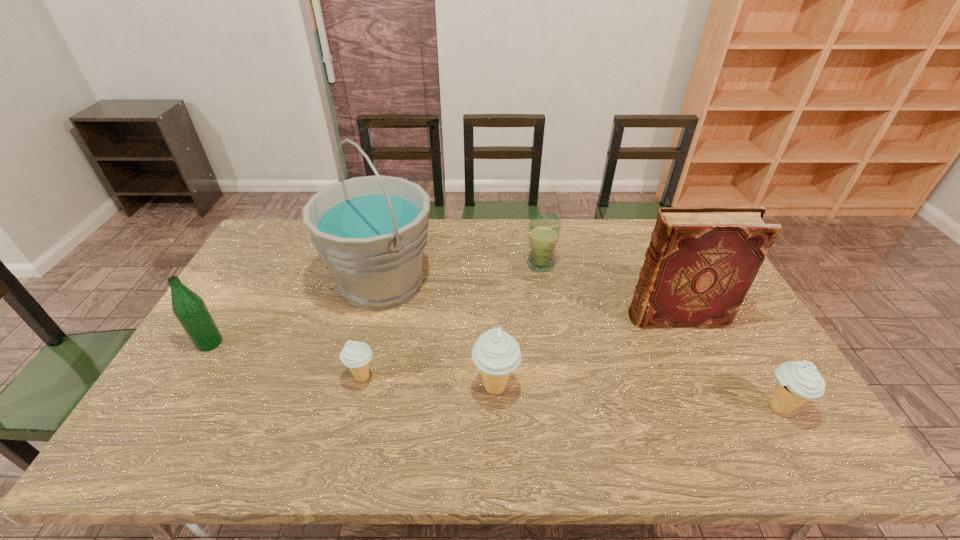
Where is `bucket present at the far edge`? The image size is (960, 540). bucket present at the far edge is located at coordinates (371, 231).

You are a GUI agent. You are given a task and a screenshot of the screen. Output one action in this format:
    pyautogui.click(x=<x>, y=<y>)
    Task: Click on the object that is at the left edge
    The width and height of the screenshot is (960, 540).
    Given the screenshot: What is the action you would take?
    pyautogui.click(x=189, y=308)

Identify the location of icecream at the right edge. The height and width of the screenshot is (540, 960). (798, 381).

Where is `hardback book situated at the right edge`? hardback book situated at the right edge is located at coordinates (701, 261).

Where is `object that is at the near right corner`? Image resolution: width=960 pixels, height=540 pixels. object that is at the near right corner is located at coordinates (798, 381).

You are a GUI agent. You are given a task and a screenshot of the screen. Output one action in this format:
    pyautogui.click(x=<x>, y=<y>)
    Task: Click on the free space at the far edge
    
    Given the screenshot: What is the action you would take?
    572,258

Locate an element on the screen. vacant region at the near edge of the desktop is located at coordinates (447, 409).

You are a GUI agent. You are given a task and a screenshot of the screen. Output one action in this format:
    pyautogui.click(x=<x>, y=<y>)
    Task: Click on the free space at the left edge of the desktop
    
    Given the screenshot: What is the action you would take?
    pyautogui.click(x=229, y=307)

Identify the location of blank space at the far left corner of the desktop. The height and width of the screenshot is (540, 960). (275, 233).

Identify the location of free spot between the second tallest icecream and the bucket. The height and width of the screenshot is (540, 960). (580, 345).